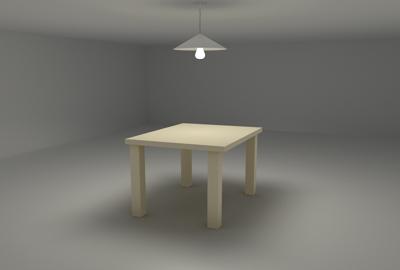
I want to click on one corner of room, so click(x=148, y=122).